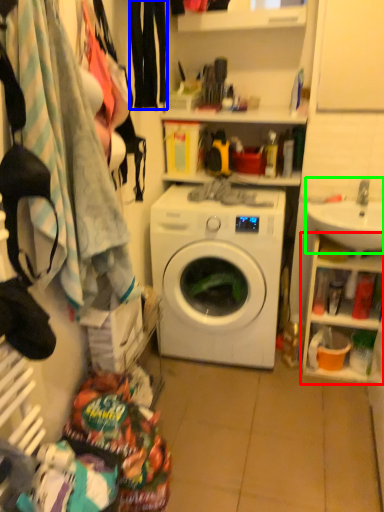
Question: Considering the real-world distances, which object is farthest from cabinet (highlighted by a red box)? clothing (highlighted by a blue box) or sink (highlighted by a green box)?

Choices:
 (A) clothing
 (B) sink

Answer: (A)